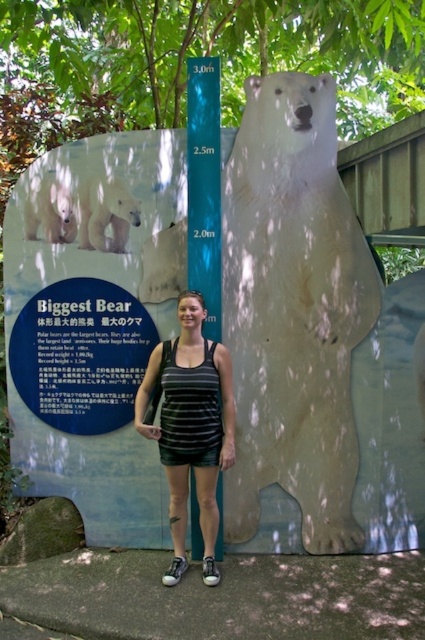
Based on the photo, is translucent plastic polar bear at center to the right of striped fabric tank top at center from the viewer's perspective?

Yes, translucent plastic polar bear at center is to the right of striped fabric tank top at center.

Does point (305, 285) come in front of point (150, 401)?

That is False.

Does point (277, 333) come closer to viewer compared to point (175, 435)?

That is False.

Where is `translucent plastic polar bear at center`? translucent plastic polar bear at center is located at coordinates (292, 310).

Does translucent plastic polar bear at center appear on the right side of white matte polar bear at upper left?

Correct, you'll find translucent plastic polar bear at center to the right of white matte polar bear at upper left.

In the scene shown: Who is higher up, translucent plastic polar bear at center or white matte polar bear at upper left?

white matte polar bear at upper left is above.

Which is behind, point (266, 253) or point (95, 189)?

The point (95, 189) is behind.

Where is `translucent plastic polar bear at center`? This screenshot has width=425, height=640. translucent plastic polar bear at center is located at coordinates (292, 310).

Who is more distant from viewer, (215, 356) or (87, 248)?

Point (87, 248)

Between striped fabric tank top at center and white matte polar bear at upper left, which one is positioned lower?

striped fabric tank top at center is below.

Find the location of `striped fabric tank top at center`. striped fabric tank top at center is located at coordinates (189, 426).

What are the coordinates of `striped fabric tank top at center` in the screenshot? It's located at (189, 426).